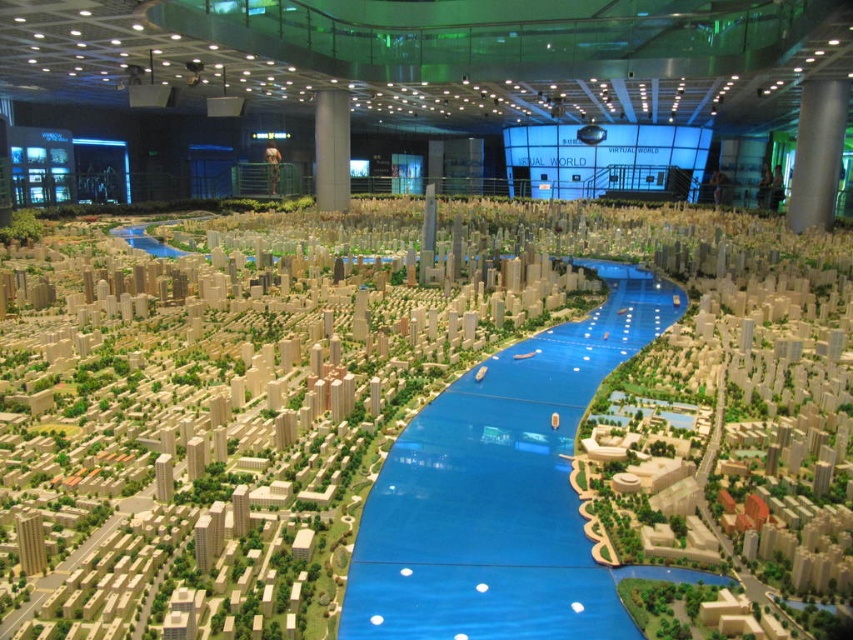
You are a visitor standing in front of the miniature city model. You notice a metallic gray pillar at upper right. Can you tell me its exact location in terms of coordinates?

The metallic gray pillar at upper right is located at point coordinates of (817, 154).

You are an architect examining the miniature city model. You need to determine the viewing angle to ensure both the transparent blue waterway at center and the white glossy pillar at center are visible. Which object would appear closer to you when looking at the model?

The transparent blue waterway at center is closer to the viewer than the white glossy pillar at center, so it would appear closer when looking at the model.